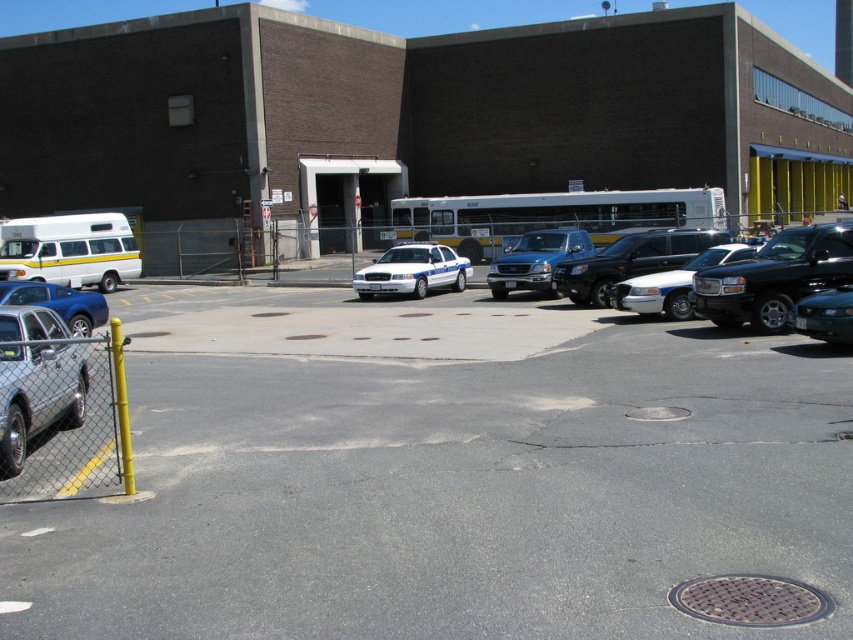
This screenshot has width=853, height=640. In order to click on white glossy police car at center in this screenshot , I will do click(x=412, y=272).

Who is more forward, (397, 285) or (670, 298)?

Point (670, 298) is in front.

Locate an element on the screen. The width and height of the screenshot is (853, 640). white glossy police car at center is located at coordinates (412, 272).

You are a GUI agent. You are given a task and a screenshot of the screen. Output one action in this format:
    pyautogui.click(x=<x>, y=<y>)
    Task: Click on the white glossy police car at center
    The width and height of the screenshot is (853, 640).
    Given the screenshot: What is the action you would take?
    pyautogui.click(x=412, y=272)

Can you confirm if gray asphalt parking lot at center is wider than white glossy police car at center?

Correct, the width of gray asphalt parking lot at center exceeds that of white glossy police car at center.

Does gray asphalt parking lot at center have a lesser width compared to white glossy police car at center?

No, gray asphalt parking lot at center is not thinner than white glossy police car at center.

Is point (415, 426) positioned after point (407, 260)?

That is False.

Locate an element on the screen. The width and height of the screenshot is (853, 640). gray asphalt parking lot at center is located at coordinates (447, 481).

Find the location of a particular element. satin black truck at center is located at coordinates (537, 260).